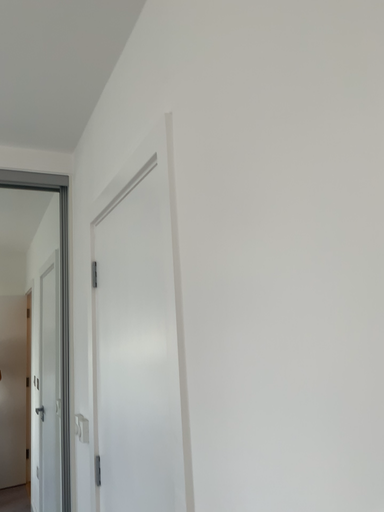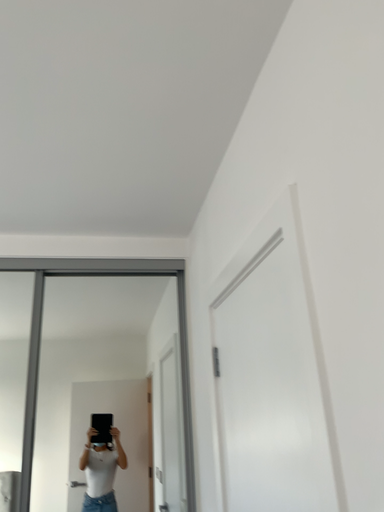
Question: How did the camera likely rotate when shooting the video?

Choices:
 (A) rotated left
 (B) rotated right

Answer: (A)